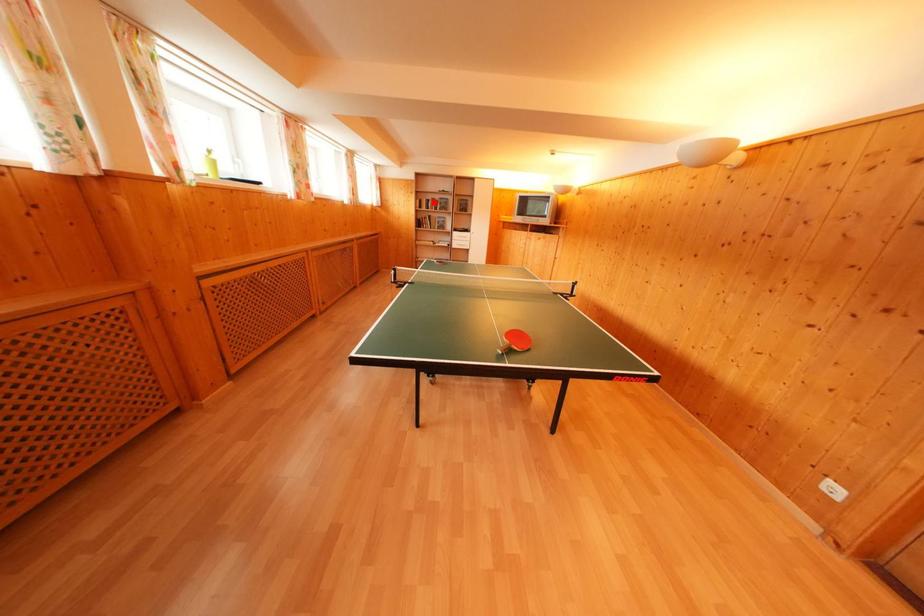
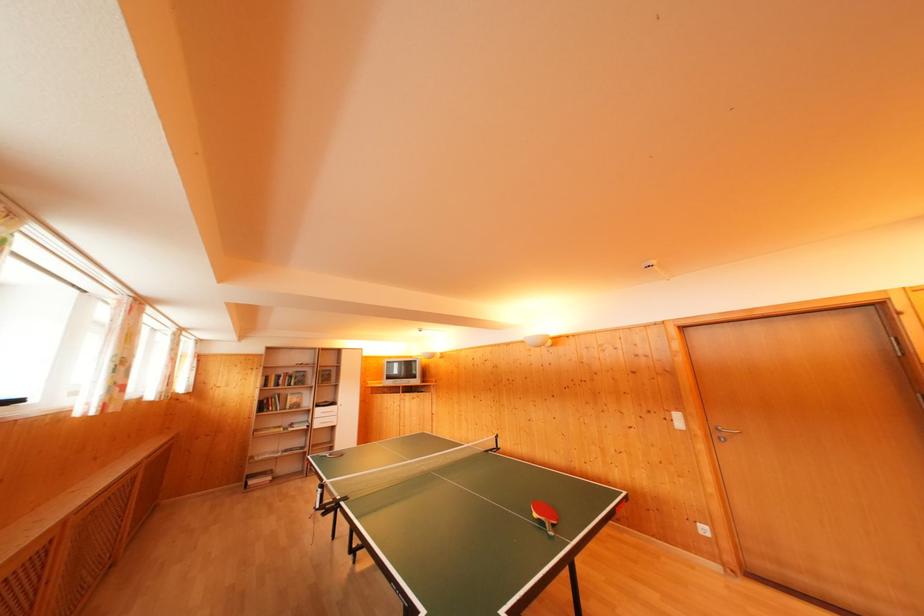
The point at the highlighted location is marked in the first image. Where is the corresponding point in the second image?

(286, 377)